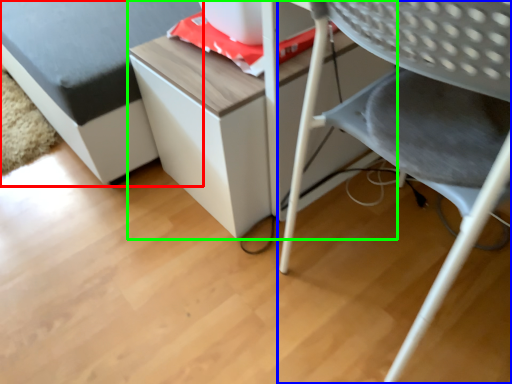
Question: Based on their relative distances, which object is farther from furniture (highlighted by a red box)? Choose from chair (highlighted by a blue box) and table (highlighted by a green box).

Choices:
 (A) chair
 (B) table

Answer: (A)